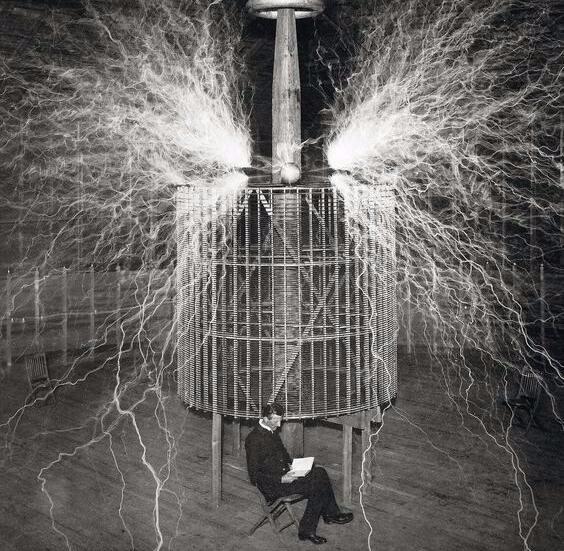
At what (x,y) coordinates should I click in order to perform the action: click on floor. Please return your answer as a coordinate pair (x, y). This screenshot has width=564, height=551. Looking at the image, I should click on (438, 453).